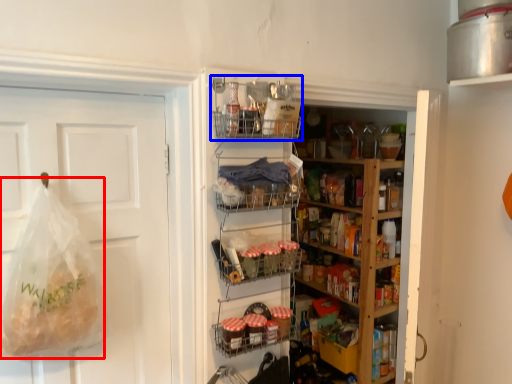
Question: Which of the following is the closest to the observer, grocery bag (highlighted by a red box) or shelf (highlighted by a blue box)?

Choices:
 (A) grocery bag
 (B) shelf

Answer: (A)